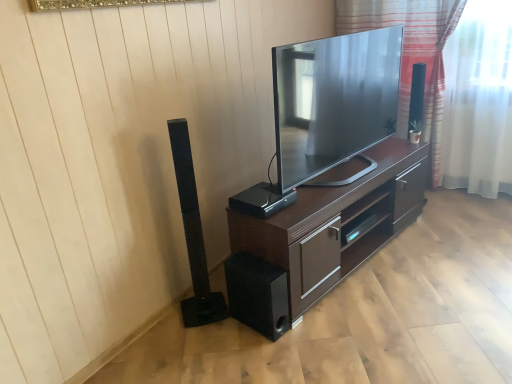
Identify the location of black matte speaker at left, the third speaker from the right. The height and width of the screenshot is (384, 512). (193, 234).

Locate an element on the screen. dark wood cabinet at center is located at coordinates (335, 223).

Locate an element on the screen. This screenshot has width=512, height=384. black plastic speaker at center, which appears as the 3th speaker when viewed from the left is located at coordinates (261, 200).

What do you see at coordinates (261, 200) in the screenshot? The width and height of the screenshot is (512, 384). I see `black plastic speaker at center, which appears as the 3th speaker when viewed from the left` at bounding box center [261, 200].

The height and width of the screenshot is (384, 512). Describe the element at coordinates (327, 110) in the screenshot. I see `matte black tv at center` at that location.

I want to click on black matte speaker at left, the first speaker viewed from the left, so click(193, 234).

Considering the positions of objects black matte speaker at left, the first speaker viewed from the left, and black matte speaker at lower center, the second speaker when ordered from left to right, in the image provided, who is in front, black matte speaker at left, the first speaker viewed from the left, or black matte speaker at lower center, the second speaker when ordered from left to right,?

black matte speaker at left, the first speaker viewed from the left.

Is black matte speaker at left, the first speaker viewed from the left, next to black matte speaker at lower center, the second speaker when ordered from left to right, and touching it?

There is a gap between black matte speaker at left, the first speaker viewed from the left, and black matte speaker at lower center, the second speaker when ordered from left to right.

Find the location of a particular element. speaker below the black matte speaker at left, the first speaker viewed from the left (from the image's perspective) is located at coordinates (257, 294).

Consider the image. Based on their sizes in the image, would you say black matte speaker at left, the third speaker from the right, is bigger or smaller than black matte speaker at lower center, the second speaker when ordered from left to right?

In the image, black matte speaker at left, the third speaker from the right, appears to be larger than black matte speaker at lower center, the second speaker when ordered from left to right.

Is the surface of black plastic speaker at center, which appears as the 3th speaker when viewed from the left, in direct contact with black matte speaker at left, the third speaker from the right?

No, black plastic speaker at center, which appears as the 3th speaker when viewed from the left, is not touching black matte speaker at left, the third speaker from the right.

From the image's perspective, is black plastic speaker at center, the 1th speaker in the right-to-left sequence, below black matte speaker at left, the third speaker from the right?

No, from the image's perspective, black plastic speaker at center, the 1th speaker in the right-to-left sequence, is not beneath black matte speaker at left, the third speaker from the right.

Looking at their sizes, would you say black plastic speaker at center, the 1th speaker in the right-to-left sequence, is wider or thinner than black matte speaker at left, the first speaker viewed from the left?

Considering their sizes, black plastic speaker at center, the 1th speaker in the right-to-left sequence, looks broader than black matte speaker at left, the first speaker viewed from the left.

Is black plastic speaker at center, the 1th speaker in the right-to-left sequence, positioned with its back to black matte speaker at left, the first speaker viewed from the left?

That's not correct — black plastic speaker at center, the 1th speaker in the right-to-left sequence, is not looking away from black matte speaker at left, the first speaker viewed from the left.

Which is more to the right, dark wood cabinet at center or striped fabric at upper right?

striped fabric at upper right is more to the right.

What's the angular difference between dark wood cabinet at center and striped fabric at upper right's facing directions?

81.5 degrees separate the facing orientations of dark wood cabinet at center and striped fabric at upper right.

Is dark wood cabinet at center not within striped fabric at upper right?

That's correct, dark wood cabinet at center is outside of striped fabric at upper right.

Is dark wood cabinet at center facing towards striped fabric at upper right?

No.

Is striped fabric at upper right facing towards black matte speaker at lower center, the second speaker when ordered from left to right?

Yes.

From a real-world perspective, who is located higher, striped fabric at upper right or black matte speaker at lower center, the 2th speaker positioned from the right?

From a 3D spatial view, striped fabric at upper right is above.

Could you measure the distance between striped fabric at upper right and black matte speaker at lower center, the 2th speaker positioned from the right?

striped fabric at upper right is 6.20 feet from black matte speaker at lower center, the 2th speaker positioned from the right.

In terms of size, does striped fabric at upper right appear bigger or smaller than black matte speaker at lower center, the 2th speaker positioned from the right?

In the image, striped fabric at upper right appears to be larger than black matte speaker at lower center, the 2th speaker positioned from the right.

Is striped fabric at upper right not near matte black tv at center?

Actually, striped fabric at upper right and matte black tv at center are a little close together.

Is striped fabric at upper right facing towards matte black tv at center?

Yes, striped fabric at upper right faces towards matte black tv at center.

At what (x,y) coordinates should I click in order to perform the action: click on television that appears on the right of black plastic speaker at center, the 1th speaker in the right-to-left sequence. Please return your answer as a coordinate pair (x, y). The height and width of the screenshot is (384, 512). Looking at the image, I should click on (327, 110).

From the image's perspective, which object appears higher, black plastic speaker at center, the 1th speaker in the right-to-left sequence, or matte black tv at center?

matte black tv at center appears higher in the image.

Does point (238, 195) come farther from viewer compared to point (292, 104)?

Yes, it is.

Which is more to the right, black plastic speaker at center, which appears as the 3th speaker when viewed from the left, or matte black tv at center?

From the viewer's perspective, matte black tv at center appears more on the right side.

Does black matte speaker at left, the first speaker viewed from the left, turn towards matte black tv at center?

No, black matte speaker at left, the first speaker viewed from the left, is not oriented towards matte black tv at center.

In the scene shown: From a real-world perspective, does black matte speaker at left, the first speaker viewed from the left, sit lower than matte black tv at center?

Yes, from a real-world perspective, black matte speaker at left, the first speaker viewed from the left, is below matte black tv at center.

Are black matte speaker at left, the first speaker viewed from the left, and matte black tv at center located far from each other?

No, black matte speaker at left, the first speaker viewed from the left, is in close proximity to matte black tv at center.

The width and height of the screenshot is (512, 384). Find the location of `speaker that is under the black matte speaker at left, the first speaker viewed from the left (from a real-world perspective)`. speaker that is under the black matte speaker at left, the first speaker viewed from the left (from a real-world perspective) is located at coordinates (257, 294).

Identify the location of speaker located above the black matte speaker at left, the third speaker from the right (from the image's perspective). (261, 200).

Looking at the image, which one is located further to black matte speaker at lower center, the 2th speaker positioned from the right, striped fabric at upper right or black plastic speaker at center, which appears as the 3th speaker when viewed from the left?

Based on the image, striped fabric at upper right appears to be further to black matte speaker at lower center, the 2th speaker positioned from the right.

When comparing their distances from black matte speaker at lower center, the second speaker when ordered from left to right, does black plastic speaker at center, the 1th speaker in the right-to-left sequence, or dark wood cabinet at center seem further?

Among the two, black plastic speaker at center, the 1th speaker in the right-to-left sequence, is located further to black matte speaker at lower center, the second speaker when ordered from left to right.

Which object lies further to the anchor point black matte speaker at lower center, the second speaker when ordered from left to right, black matte speaker at left, the first speaker viewed from the left, or matte black tv at center?

→ matte black tv at center is further to black matte speaker at lower center, the second speaker when ordered from left to right.

From the image, which object appears to be farther from black matte speaker at left, the third speaker from the right, dark wood cabinet at center or black matte speaker at lower center, the second speaker when ordered from left to right?

dark wood cabinet at center is further to black matte speaker at left, the third speaker from the right.

Based on their spatial positions, is striped fabric at upper right or matte black tv at center closer to black matte speaker at left, the third speaker from the right?

matte black tv at center.

Estimate the real-world distances between objects in this image. Which object is closer to black matte speaker at lower center, the 2th speaker positioned from the right, black matte speaker at left, the third speaker from the right, or black plastic speaker at center, which appears as the 3th speaker when viewed from the left?

Among the two, black matte speaker at left, the third speaker from the right, is located nearer to black matte speaker at lower center, the 2th speaker positioned from the right.

Looking at the image, which one is located closer to striped fabric at upper right, black matte speaker at left, the third speaker from the right, or dark wood cabinet at center?

dark wood cabinet at center lies closer to striped fabric at upper right than the other object.

Based on their spatial positions, is black matte speaker at lower center, the second speaker when ordered from left to right, or striped fabric at upper right closer to black plastic speaker at center, which appears as the 3th speaker when viewed from the left?

black matte speaker at lower center, the second speaker when ordered from left to right, is closer to black plastic speaker at center, which appears as the 3th speaker when viewed from the left.

The image size is (512, 384). What are the coordinates of `cabinetry between matte black tv at center and black matte speaker at lower center, the second speaker when ordered from left to right, in the up-down direction` in the screenshot? It's located at (335, 223).

Locate an element on the screen. Image resolution: width=512 pixels, height=384 pixels. television between black matte speaker at left, the third speaker from the right, and dark wood cabinet at center, in the horizontal direction is located at coordinates (327, 110).

You are a GUI agent. You are given a task and a screenshot of the screen. Output one action in this format:
    pyautogui.click(x=<x>, y=<y>)
    Task: Click on the speaker between black matte speaker at lower center, the second speaker when ordered from left to right, and dark wood cabinet at center
    The image size is (512, 384).
    Given the screenshot: What is the action you would take?
    pyautogui.click(x=261, y=200)

Find the location of a particular element. This screenshot has height=384, width=512. speaker that lies between matte black tv at center and dark wood cabinet at center from top to bottom is located at coordinates (261, 200).